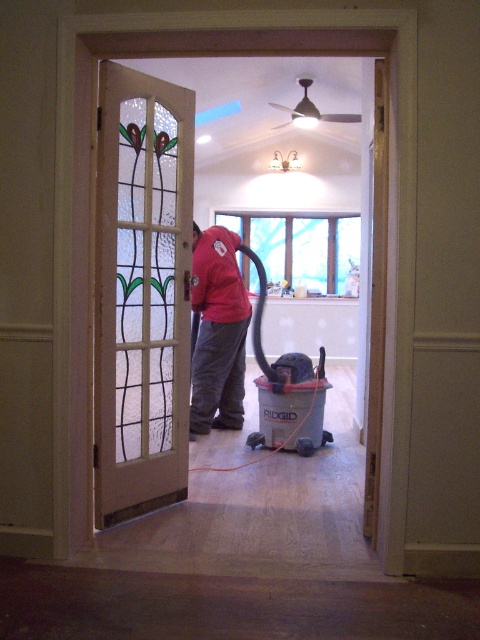
Which of these two, stained glass door at left or red matte jacket at center, stands shorter?

Standing shorter between the two is red matte jacket at center.

Can you confirm if stained glass door at left is positioned below red matte jacket at center?

No, stained glass door at left is not below red matte jacket at center.

What do you see at coordinates (142, 292) in the screenshot?
I see `stained glass door at left` at bounding box center [142, 292].

Where is `stained glass door at left`? Image resolution: width=480 pixels, height=640 pixels. stained glass door at left is located at coordinates (142, 292).